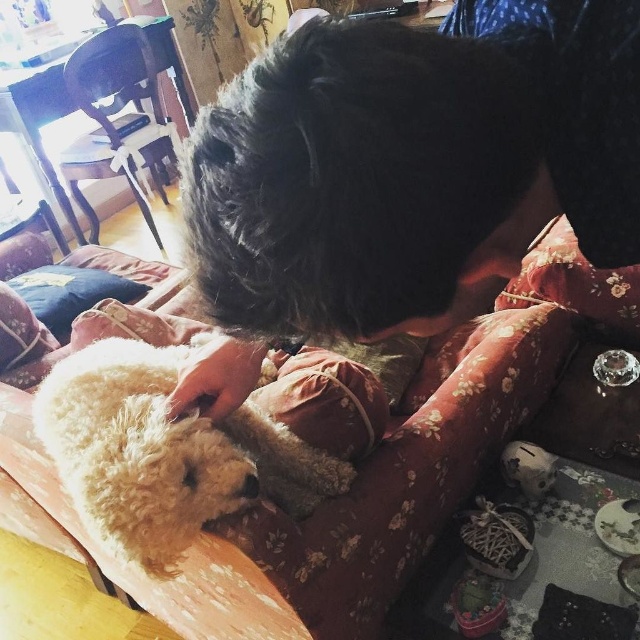
Looking at this image, does white fluffy dog at center have a larger size compared to fluffy fabric pillow at lower left?

Yes, white fluffy dog at center is bigger than fluffy fabric pillow at lower left.

The height and width of the screenshot is (640, 640). Identify the location of white fluffy dog at center. (163, 452).

Locate an element on the screen. white fluffy dog at center is located at coordinates (163, 452).

Is floral fabric couch at center further to the viewer compared to white fluffy dog at center?

Yes, it is.

How distant is floral fabric couch at center from white fluffy dog at center?

floral fabric couch at center and white fluffy dog at center are 8.37 inches apart.

I want to click on floral fabric couch at center, so click(x=339, y=497).

Who is more forward, [221,112] or [328,538]?

Positioned in front is point [221,112].

Is black fluffy dog at upper center to the left of floral fabric couch at center from the viewer's perspective?

In fact, black fluffy dog at upper center is to the right of floral fabric couch at center.

Is point (276, 280) farther from viewer compared to point (372, 410)?

No.

At what (x,y) coordinates should I click in order to perform the action: click on black fluffy dog at upper center. Please return your answer as a coordinate pair (x, y). The height and width of the screenshot is (640, 640). Looking at the image, I should click on (408, 160).